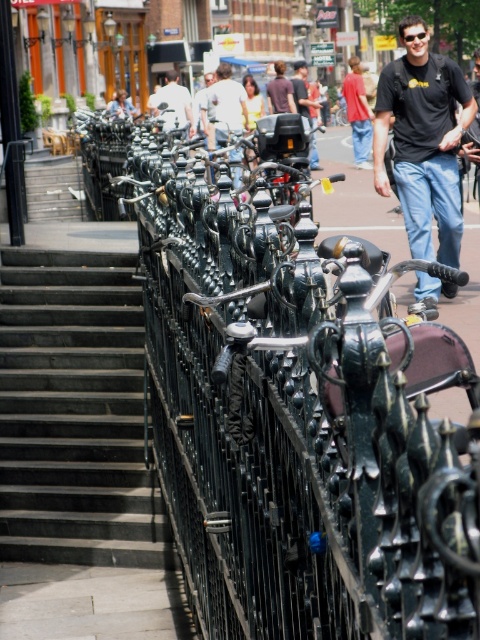
Question: Which point appears closest to the camera in this image?

Choices:
 (A) (176, 92)
 (B) (133, 266)
 (C) (455, 236)
 (D) (372, 252)

Answer: (D)

Question: Is black matte t-shirt at upper right closer to the viewer compared to white shirt at center?

Choices:
 (A) yes
 (B) no

Answer: (A)

Question: Can you confirm if white shirt at center is wider than white matte shirt at upper center?

Choices:
 (A) yes
 (B) no

Answer: (B)

Question: Which object is farther from the camera taking this photo?

Choices:
 (A) dark blue jeans at center
 (B) dark gray concrete stairs at lower left
 (C) white shirt at center
 (D) black matte t-shirt at upper right

Answer: (A)

Question: Is black matte t-shirt at upper right positioned before white shirt at center?

Choices:
 (A) no
 (B) yes

Answer: (B)

Question: Among these points, which one is nearest to the camera?

Choices:
 (A) (381, 108)
 (B) (226, 140)
 (C) (301, 104)
 (D) (171, 104)

Answer: (A)